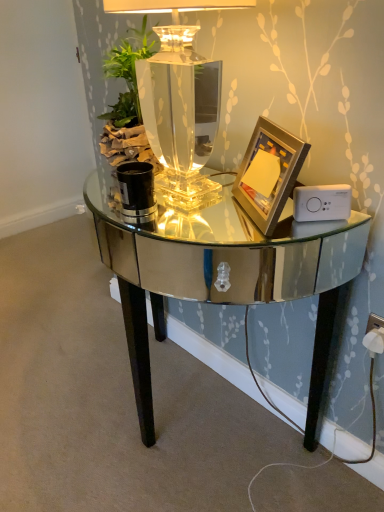
Question: Should I look upward or downward to see clear glass table lamp at center?

Choices:
 (A) up
 (B) down

Answer: (A)

Question: Considering the relative sizes of white plastic socket at lower right and gold metallic picture frame at right in the image provided, is white plastic socket at lower right thinner than gold metallic picture frame at right?

Choices:
 (A) yes
 (B) no

Answer: (A)

Question: Is the position of white plastic socket at lower right less distant than that of gold metallic picture frame at right?

Choices:
 (A) no
 (B) yes

Answer: (A)

Question: Is gold metallic picture frame at right at the back of white plastic socket at lower right?

Choices:
 (A) yes
 (B) no

Answer: (B)

Question: From a real-world perspective, is white plastic socket at lower right physically below gold metallic picture frame at right?

Choices:
 (A) yes
 (B) no

Answer: (A)

Question: Considering the relative positions of white plastic socket at lower right and gold metallic picture frame at right in the image provided, is white plastic socket at lower right behind gold metallic picture frame at right?

Choices:
 (A) no
 (B) yes

Answer: (B)

Question: From the image's perspective, is white plastic socket at lower right over gold metallic picture frame at right?

Choices:
 (A) no
 (B) yes

Answer: (A)

Question: Can you confirm if gold metallic picture frame at right is smaller than clear glass table lamp at center?

Choices:
 (A) no
 (B) yes

Answer: (B)

Question: Can you see gold metallic picture frame at right touching clear glass table lamp at center?

Choices:
 (A) yes
 (B) no

Answer: (B)

Question: Is gold metallic picture frame at right located outside clear glass table lamp at center?

Choices:
 (A) no
 (B) yes

Answer: (A)

Question: Does gold metallic picture frame at right have a greater height compared to clear glass table lamp at center?

Choices:
 (A) no
 (B) yes

Answer: (A)

Question: From the image's perspective, would you say gold metallic picture frame at right is shown under clear glass table lamp at center?

Choices:
 (A) no
 (B) yes

Answer: (B)

Question: Considering the relative sizes of gold metallic picture frame at right and clear glass table lamp at center in the image provided, is gold metallic picture frame at right bigger than clear glass table lamp at center?

Choices:
 (A) yes
 (B) no

Answer: (B)

Question: From the image's perspective, is clear glass table lamp at center on top of mirrored glass table at center?

Choices:
 (A) no
 (B) yes

Answer: (B)